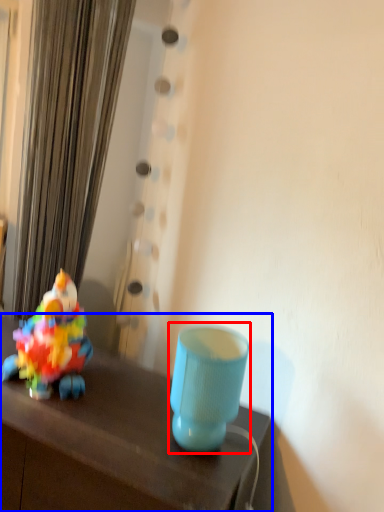
Question: Which object is closer to the camera taking this photo, table lamp (highlighted by a red box) or table (highlighted by a blue box)?

Choices:
 (A) table lamp
 (B) table

Answer: (B)